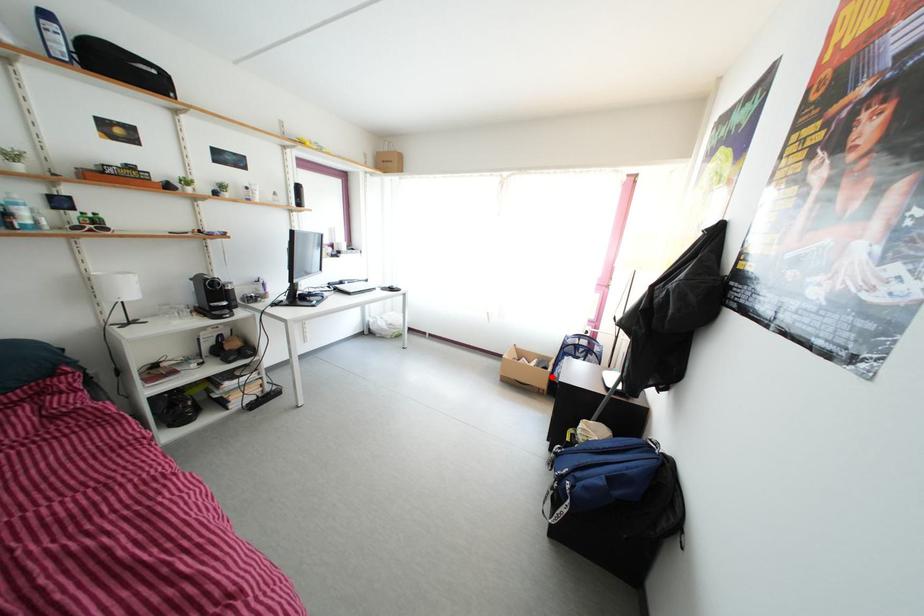
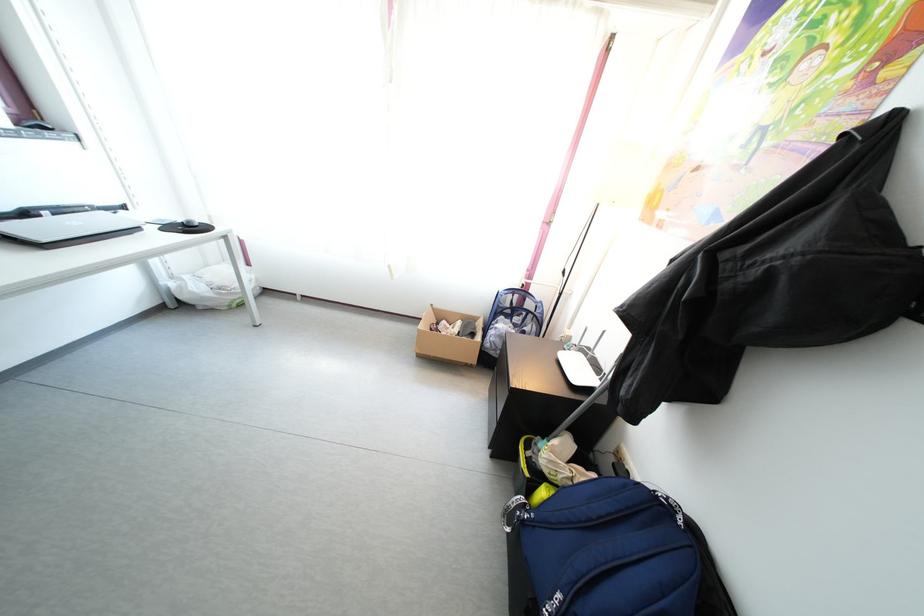
Where in the second image is the point corresponding to the highlighted location from the first image?

(480, 342)